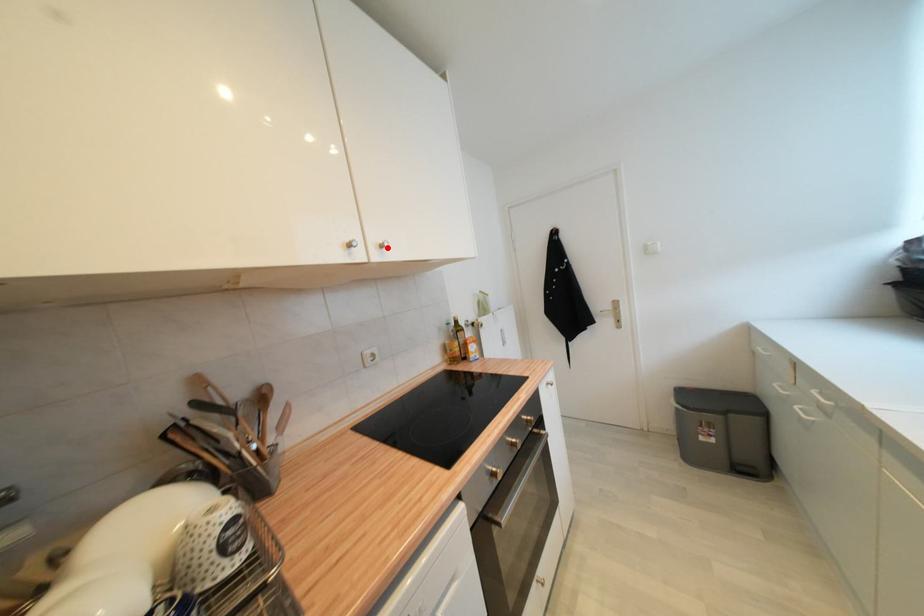
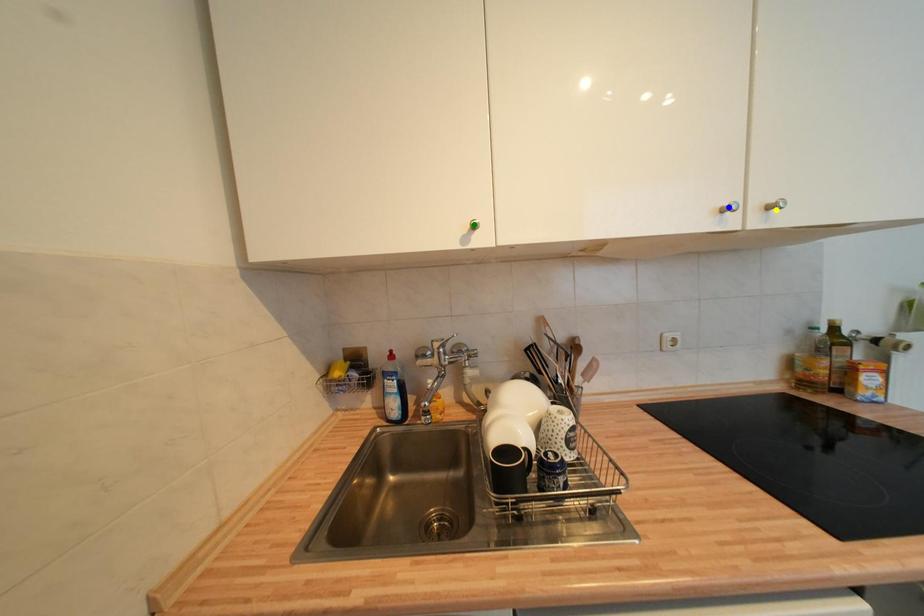
Question: I am providing you with two images of the same scene from different viewpoints. A red point is marked on the first image. You are given multiple points on the second image. Which spot in image 2 lines up with the point in image 1?

Choices:
 (A) yellow point
 (B) blue point
 (C) green point

Answer: (A)